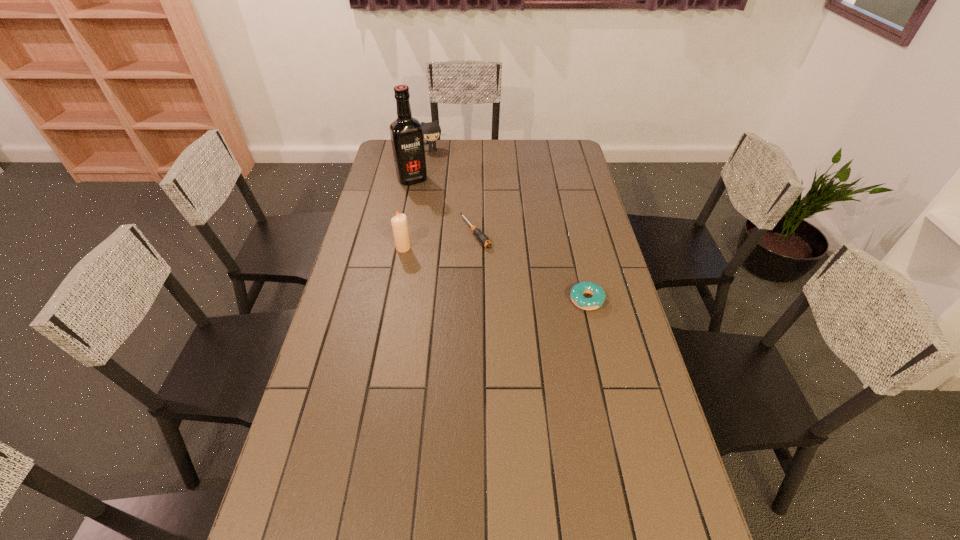
Image resolution: width=960 pixels, height=540 pixels. What are the coordinates of `object identified as the closest to the liquor` in the screenshot? It's located at (431, 131).

Locate which object ranks in proximity to the fourth shortest object. Please provide its 2D coordinates. Your answer should be formatted as a tuple, i.e. [(x, y)], where the tuple contains the x and y coordinates of a point satisfying the conditions above.

[(483, 239)]

I want to click on vacant point that satisfies the following two spatial constraints: 1. on the front side of the doughnut; 2. on the left side of the tallest object, so (x=389, y=300).

Where is `vacant area that satisfies the following two spatial constraints: 1. on the front side of the screwdriver; 2. on the right side of the rightmost object`? This screenshot has width=960, height=540. vacant area that satisfies the following two spatial constraints: 1. on the front side of the screwdriver; 2. on the right side of the rightmost object is located at coordinates (474, 300).

Locate an element on the screen. free space that satisfies the following two spatial constraints: 1. on the back side of the second object from right to left; 2. on the right side of the candle is located at coordinates (406, 233).

The image size is (960, 540). In order to click on free region that satisfies the following two spatial constraints: 1. on the front side of the rightmost object; 2. on the right side of the liquor in this screenshot , I will do `click(389, 300)`.

Find the location of a particular element. vacant space that satisfies the following two spatial constraints: 1. on the back side of the fourth shortest object; 2. on the left side of the second object from right to left is located at coordinates (406, 233).